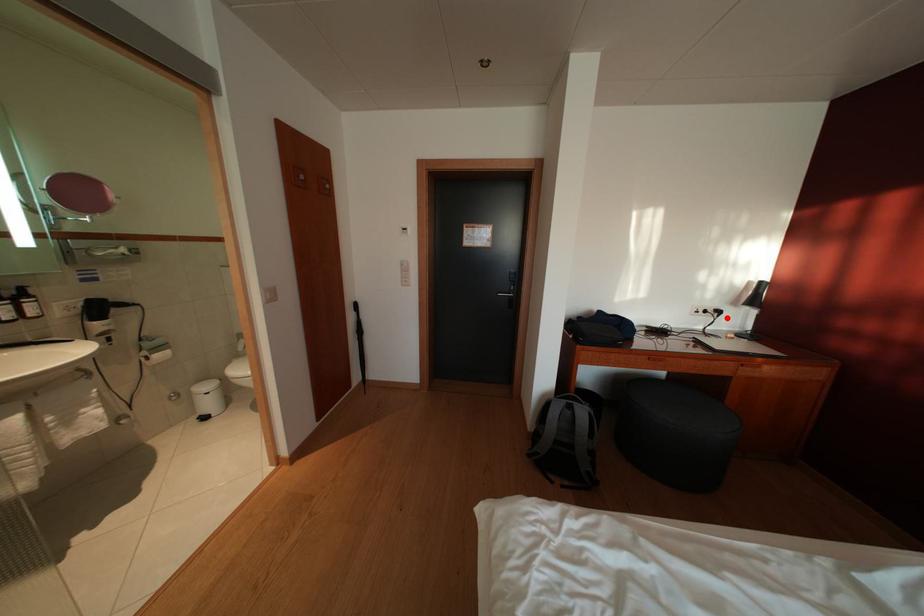
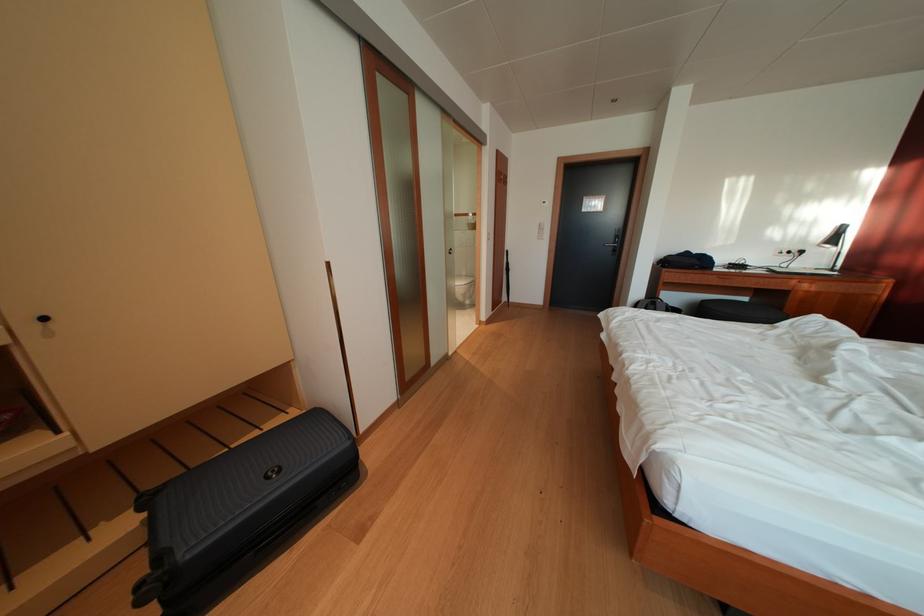
Where in the second image is the point corresponding to the highlighted location from the first image?

(809, 257)